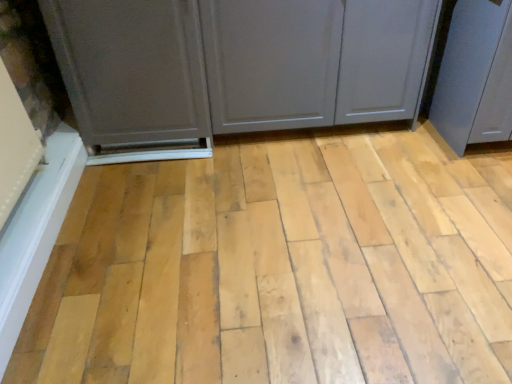
Question: Does matte gray cabinet at left, which appears as the second screen door when viewed from the right, have a lesser width compared to matte gray screen door at right, the first screen door in the right-to-left sequence?

Choices:
 (A) yes
 (B) no

Answer: (A)

Question: From a real-world perspective, is matte gray cabinet at left, which appears as the second screen door when viewed from the right, on top of matte gray screen door at right, which appears as the 2th screen door when viewed from the left?

Choices:
 (A) yes
 (B) no

Answer: (A)

Question: Can you confirm if matte gray cabinet at left, the first screen door when ordered from left to right, is wider than matte gray screen door at right, which appears as the 2th screen door when viewed from the left?

Choices:
 (A) yes
 (B) no

Answer: (B)

Question: Is matte gray cabinet at left, the first screen door when ordered from left to right, next to matte gray screen door at right, which appears as the 2th screen door when viewed from the left, and touching it?

Choices:
 (A) no
 (B) yes

Answer: (A)

Question: Is matte gray cabinet at left, which appears as the second screen door when viewed from the right, shorter than matte gray screen door at right, which appears as the 2th screen door when viewed from the left?

Choices:
 (A) yes
 (B) no

Answer: (B)

Question: Can you confirm if matte gray cabinet at left, which appears as the second screen door when viewed from the right, is positioned to the right of matte gray screen door at right, which appears as the 2th screen door when viewed from the left?

Choices:
 (A) yes
 (B) no

Answer: (B)

Question: From the image's perspective, is matte gray cabinet at left, which appears as the second screen door when viewed from the right, located above matte gray cupboard at center?

Choices:
 (A) yes
 (B) no

Answer: (B)

Question: From a real-world perspective, is matte gray cabinet at left, the first screen door when ordered from left to right, on top of matte gray cupboard at center?

Choices:
 (A) no
 (B) yes

Answer: (B)

Question: Is matte gray cupboard at center located within matte gray cabinet at left, the first screen door when ordered from left to right?

Choices:
 (A) yes
 (B) no

Answer: (B)

Question: Is matte gray cabinet at left, the first screen door when ordered from left to right, not inside matte gray cupboard at center?

Choices:
 (A) yes
 (B) no

Answer: (A)

Question: Does matte gray cabinet at left, the first screen door when ordered from left to right, have a smaller size compared to matte gray cupboard at center?

Choices:
 (A) yes
 (B) no

Answer: (A)

Question: Is the surface of matte gray cabinet at left, which appears as the second screen door when viewed from the right, in direct contact with matte gray cupboard at center?

Choices:
 (A) no
 (B) yes

Answer: (A)

Question: From the image's perspective, is matte gray cupboard at center located beneath matte gray screen door at right, which appears as the 2th screen door when viewed from the left?

Choices:
 (A) yes
 (B) no

Answer: (A)